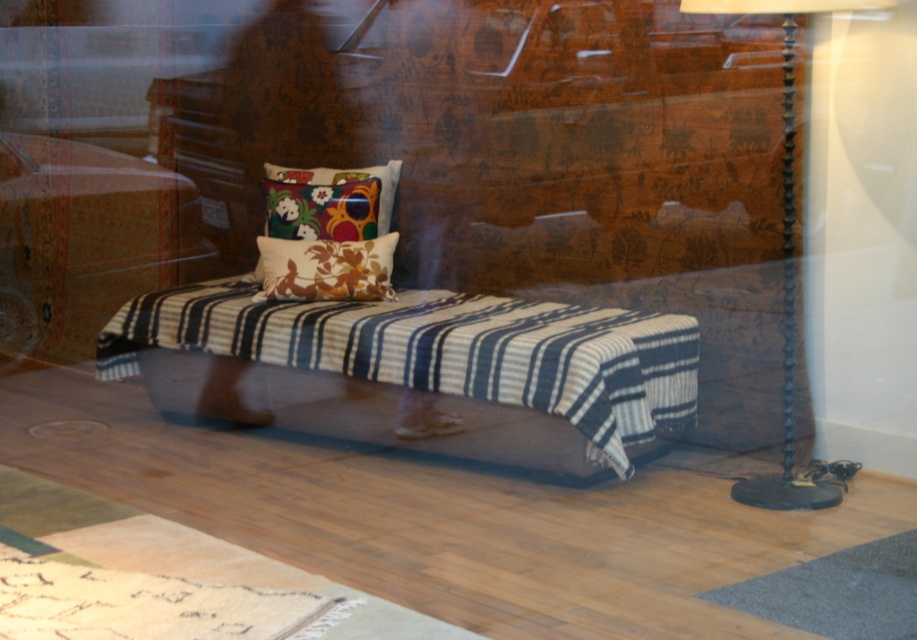
You are a decorator arranging items in the scene. You need to place a new small plant that must be placed above the striped fabric bench at center. Is there space above the bench where the floral fabric cushion at center is currently located to place the plant?

The striped fabric bench at center is below floral fabric cushion at center, so yes, there is space above the bench where the floral fabric cushion at center is placed to put the plant.

You are standing in the showroom and want to place a new decorative pillow on the striped fabric bench at center. According to the coordinates provided, where exactly should you aim to place the pillow?

The striped fabric bench at center is located at coordinates point (471,349), so you should aim for that position to place the new decorative pillow.